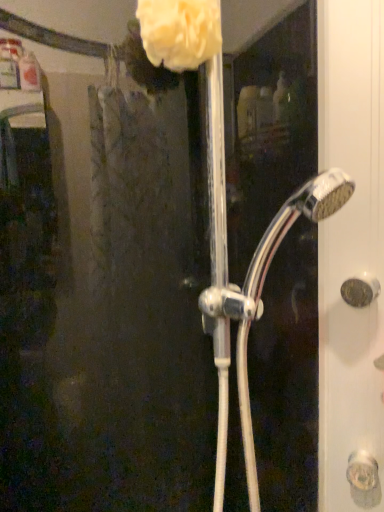
What is the approximate height of matte gold door handle at right?

The height of matte gold door handle at right is 2.40 inches.

This screenshot has height=512, width=384. Describe the element at coordinates (180, 32) in the screenshot. I see `white fluffy sponge at upper center` at that location.

This screenshot has height=512, width=384. Identify the location of chrome metallic showerhead at center. (283, 97).

Is matte gold door handle at right positioned with its back to chrome metallic showerhead at center?

No, chrome metallic showerhead at center is not at the back of matte gold door handle at right.

Considering the sizes of objects matte gold door handle at right and chrome metallic showerhead at center in the image provided, who is bigger, matte gold door handle at right or chrome metallic showerhead at center?

chrome metallic showerhead at center.

Is matte gold door handle at right in contact with chrome metallic showerhead at center?

No, matte gold door handle at right is not in contact with chrome metallic showerhead at center.

How distant is matte gold door handle at right from chrome metallic showerhead at center?

matte gold door handle at right and chrome metallic showerhead at center are 23.01 centimeters apart.

Is white fluffy sponge at upper center taller than matte gold door handle at right?

Yes.

Which point is more forward, (184, 51) or (366, 302)?

The point (184, 51) is in front.

From a real-world perspective, is white fluffy sponge at upper center physically located above or below matte gold door handle at right?

From a real-world perspective, white fluffy sponge at upper center is physically above matte gold door handle at right.

Looking at their sizes, would you say matte gold door handle at right is wider or thinner than white fluffy sponge at upper center?

Clearly, matte gold door handle at right has less width compared to white fluffy sponge at upper center.

Is matte gold door handle at right touching white fluffy sponge at upper center?

No, matte gold door handle at right is not touching white fluffy sponge at upper center.

In the scene shown: How distant is matte gold door handle at right from white fluffy sponge at upper center?

matte gold door handle at right and white fluffy sponge at upper center are 16.79 inches apart.

Between matte gold door handle at right and white fluffy sponge at upper center, which one appears on the left side from the viewer's perspective?

white fluffy sponge at upper center is more to the left.

Based on the photo, is chrome metallic showerhead at center to the left of matte gold door handle at right from the viewer's perspective?

Yes.

Consider the image. From a real-world perspective, is chrome metallic showerhead at center located beneath matte gold door handle at right?

No, from a real-world perspective, chrome metallic showerhead at center is not under matte gold door handle at right.

Which object is more forward, chrome metallic showerhead at center or matte gold door handle at right?

chrome metallic showerhead at center is closer to the camera.

From the image's perspective, which one is positioned lower, chrome metallic showerhead at center or matte gold door handle at right?

matte gold door handle at right, from the image's perspective.

Looking at the image, does white fluffy sponge at upper center seem bigger or smaller compared to chrome metallic showerhead at center?

white fluffy sponge at upper center is smaller than chrome metallic showerhead at center.

Can you tell me how much white fluffy sponge at upper center and chrome metallic showerhead at center differ in facing direction?

The facing directions of white fluffy sponge at upper center and chrome metallic showerhead at center are 0.000975 degrees apart.

From a real-world perspective, who is located higher, white fluffy sponge at upper center or chrome metallic showerhead at center?

From a 3D spatial view, white fluffy sponge at upper center is above.

This screenshot has width=384, height=512. In order to click on screen door that appears on the right of white fluffy sponge at upper center in this screenshot , I will do `click(283, 97)`.

Is chrome metallic showerhead at center in front of or behind white fluffy sponge at upper center in the image?

chrome metallic showerhead at center is positioned closer to the viewer than white fluffy sponge at upper center.

Is chrome metallic showerhead at center next to white fluffy sponge at upper center?

No.

From a real-world perspective, between chrome metallic showerhead at center and white fluffy sponge at upper center, who is vertically lower?

In real-world perspective, chrome metallic showerhead at center is lower.

Is white fluffy sponge at upper center completely or partially inside chrome metallic showerhead at center?

Yes, white fluffy sponge at upper center is surrounded by chrome metallic showerhead at center.

I want to click on door handle on the right of chrome metallic showerhead at center, so click(360, 291).

This screenshot has width=384, height=512. Find the location of `flower located on the left of matte gold door handle at right`. flower located on the left of matte gold door handle at right is located at coordinates (180, 32).

Estimate the real-world distances between objects in this image. Which object is closer to white fluffy sponge at upper center, chrome metallic showerhead at center or matte gold door handle at right?

chrome metallic showerhead at center.

Estimate the real-world distances between objects in this image. Which object is further from matte gold door handle at right, chrome metallic showerhead at center or white fluffy sponge at upper center?

white fluffy sponge at upper center is further to matte gold door handle at right.

Based on their spatial positions, is white fluffy sponge at upper center or chrome metallic showerhead at center closer to matte gold door handle at right?

chrome metallic showerhead at center lies closer to matte gold door handle at right than the other object.

Estimate the real-world distances between objects in this image. Which object is further from chrome metallic showerhead at center, matte gold door handle at right or white fluffy sponge at upper center?

Based on the image, white fluffy sponge at upper center appears to be further to chrome metallic showerhead at center.

Considering their positions, is matte gold door handle at right positioned further to white fluffy sponge at upper center than chrome metallic showerhead at center?

matte gold door handle at right lies further to white fluffy sponge at upper center than the other object.

Estimate the real-world distances between objects in this image. Which object is closer to chrome metallic showerhead at center, white fluffy sponge at upper center or matte gold door handle at right?

matte gold door handle at right is positioned closer to the anchor chrome metallic showerhead at center.

Locate an element on the screen. The image size is (384, 512). screen door between white fluffy sponge at upper center and matte gold door handle at right vertically is located at coordinates (283, 97).